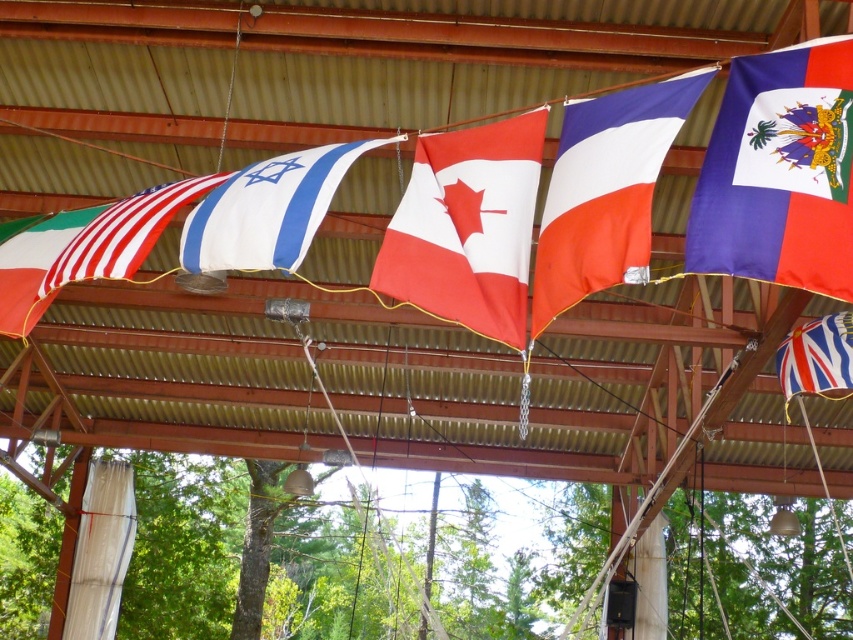
You are at a cultural event and see the blue fabric flag at upper right and the white cotton flag at center. Which flag is positioned higher in the display?

The blue fabric flag at upper right is positioned higher than the white cotton flag at center.

You are standing in front of the flag display and want to identify the flag that has a point at coordinate (779, 172). Which flag is it?

The point at coordinate (779, 172) is on the blue fabric flag at upper right.